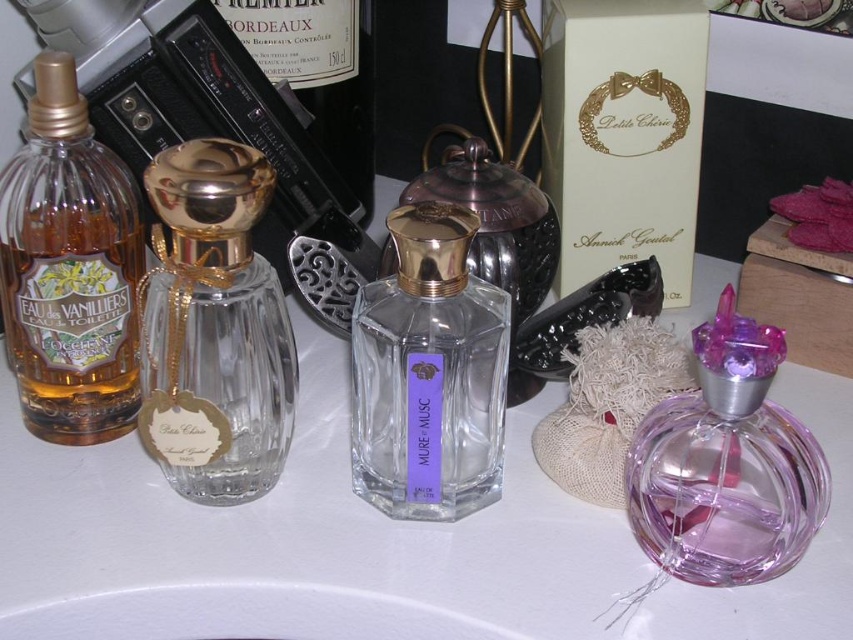
Can you confirm if white matte counter top at center is taller than transparent glass perfume at center?

Yes.

Is white matte counter top at center above transparent glass perfume at center?

Correct, white matte counter top at center is located above transparent glass perfume at center.

Is point (532, 406) positioned before point (427, 209)?

No, (532, 406) is further to viewer.

I want to click on white matte counter top at center, so click(372, 541).

Who is shorter, clear glass perfume at center or matte glass bottle at left?

Standing shorter between the two is clear glass perfume at center.

Consider the image. Does clear glass perfume at center appear on the right side of matte glass bottle at left?

Correct, you'll find clear glass perfume at center to the right of matte glass bottle at left.

Who is more forward, (178, 380) or (55, 276)?

Point (178, 380)

This screenshot has height=640, width=853. Identify the location of clear glass perfume at center. (213, 326).

Is point (346, 579) farther from camera compared to point (721, 516)?

Yes, point (346, 579) is behind point (721, 516).

What are the coordinates of `white matte counter top at center` in the screenshot? It's located at (372, 541).